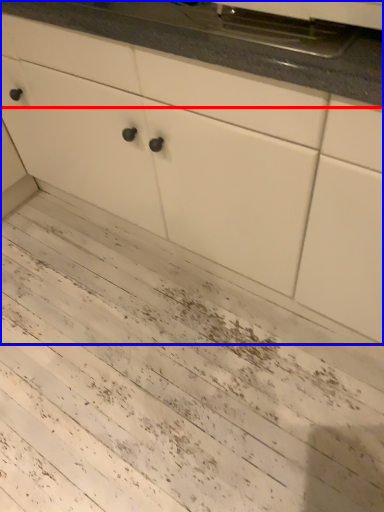
Question: Which point is further to the camera, countertop (highlighted by a red box) or cabinetry (highlighted by a blue box)?

Choices:
 (A) countertop
 (B) cabinetry

Answer: (A)